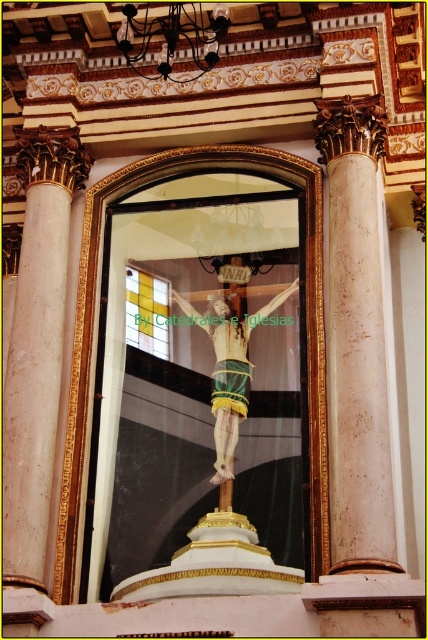
Based on the photo, you are an interior designer assessing the placement of the transparent glass crucifix at center and the white marble column at center. Which object is located to the right of the other?

The transparent glass crucifix at center is positioned on the right side of the white marble column at center.

Consider the image. You are an interior designer assessing the placement of objects in a religious space. You see the white marble column at right and the polished gold crucifix at center. Which object is located to the right of the other?

The white marble column at right is positioned on the right side of the polished gold crucifix at center, so the white marble column at right is to the right of the polished gold crucifix at center.